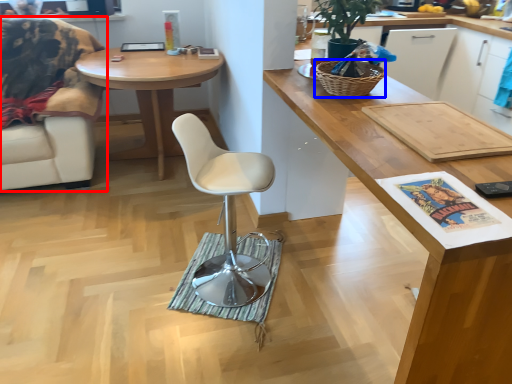
Question: Which object is further to the camera taking this photo, chair (highlighted by a red box) or picnic basket (highlighted by a blue box)?

Choices:
 (A) chair
 (B) picnic basket

Answer: (A)